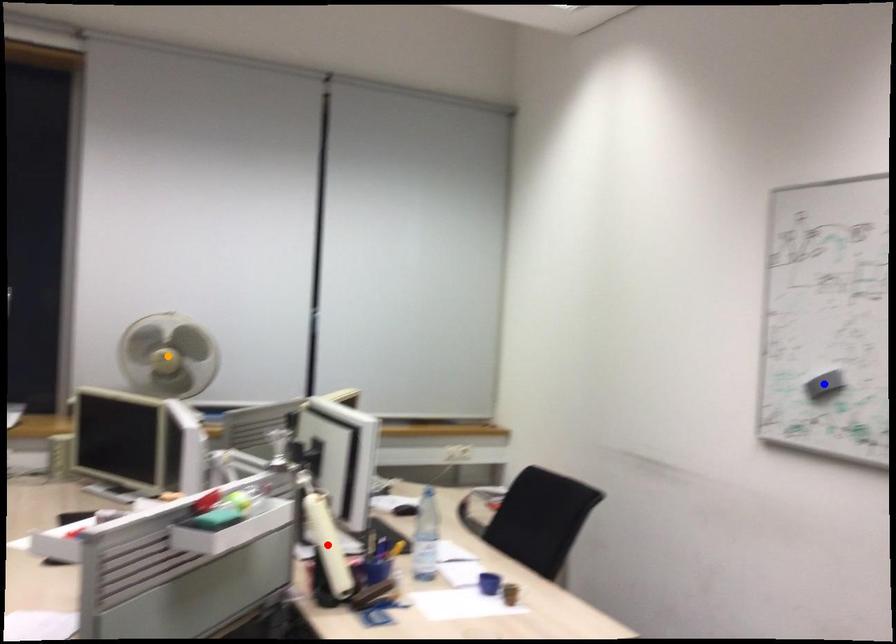
Order these from nearest to farthest:
red point | blue point | orange point

red point
blue point
orange point